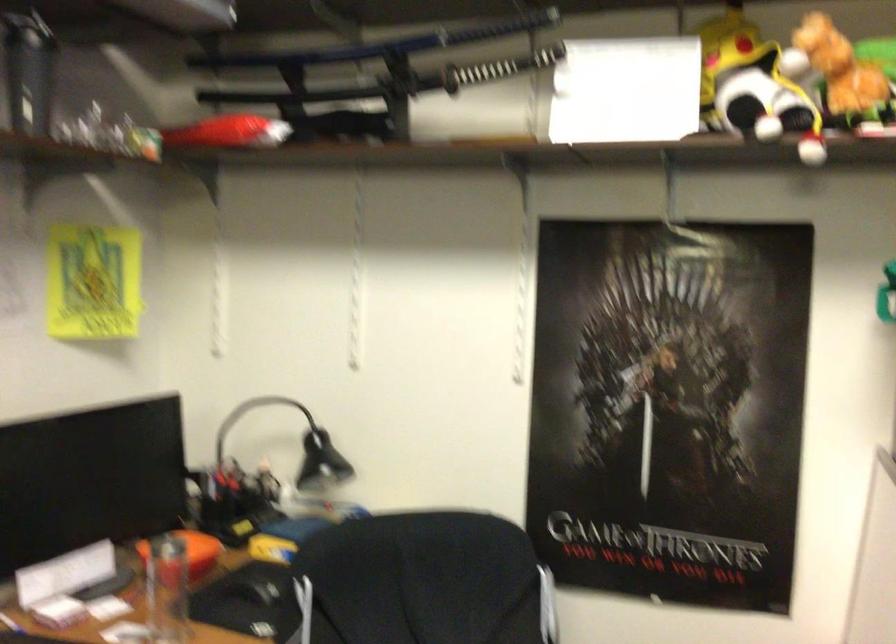
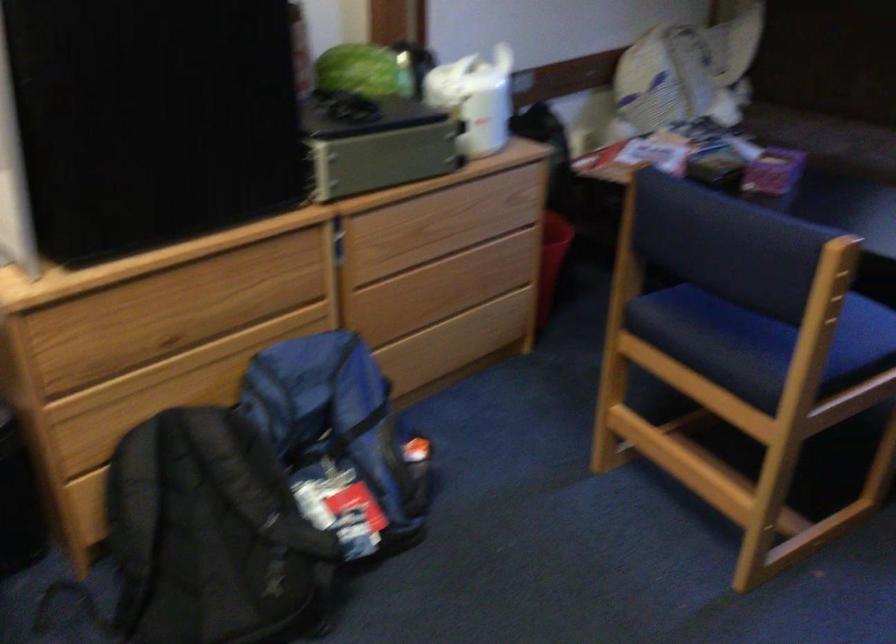
How did the camera likely rotate?

The rotation direction of the camera is right-down.